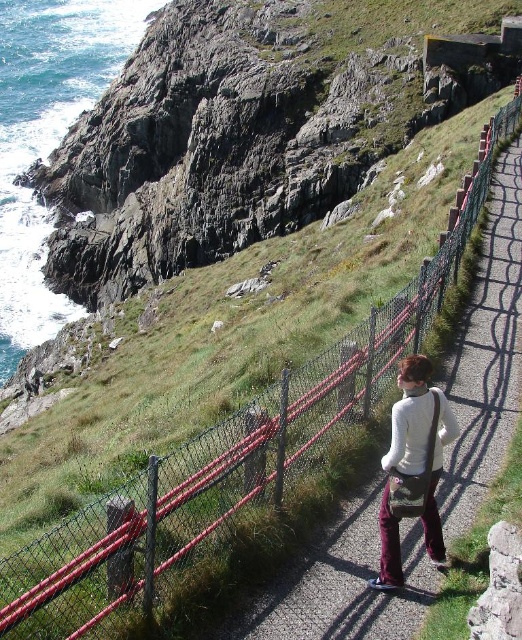
Can you confirm if green grassy hillside at upper left is bigger than white matte sweater at center?

Indeed, green grassy hillside at upper left has a larger size compared to white matte sweater at center.

Which of these two, green grassy hillside at upper left or white matte sweater at center, stands taller?

With more height is green grassy hillside at upper left.

Between point (496, 3) and point (432, 387), which one is positioned behind?

The point (496, 3) is behind.

This screenshot has width=522, height=640. I want to click on green grassy hillside at upper left, so click(246, 129).